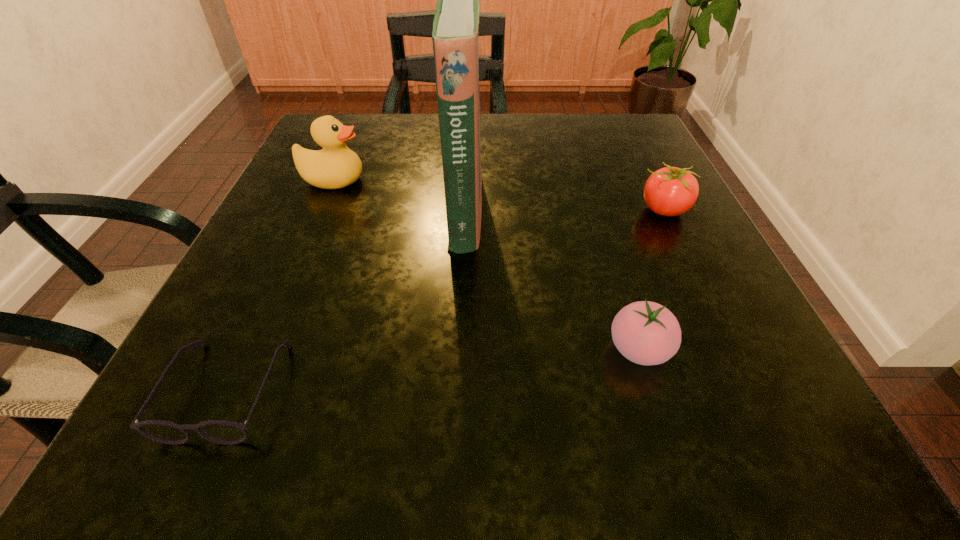
What are the coordinates of `free space that satisfies the following two spatial constraints: 1. on the back side of the nearer tomato; 2. at the beak of the duck` in the screenshot? It's located at (587, 180).

This screenshot has width=960, height=540. What are the coordinates of `free space that satisfies the following two spatial constraints: 1. on the cover of the hardback book; 2. on the right side of the right tomato` in the screenshot? It's located at (465, 210).

This screenshot has height=540, width=960. I want to click on vacant area that satisfies the following two spatial constraints: 1. on the cover of the fourth object from left to right; 2. on the right side of the hardback book, so click(x=459, y=349).